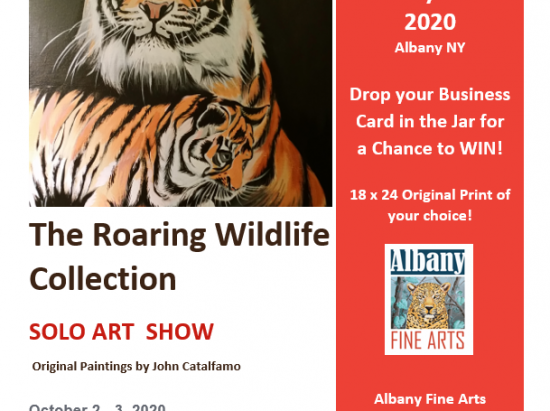
Where is `tiger on poster`? This screenshot has width=550, height=411. tiger on poster is located at coordinates (417, 309).